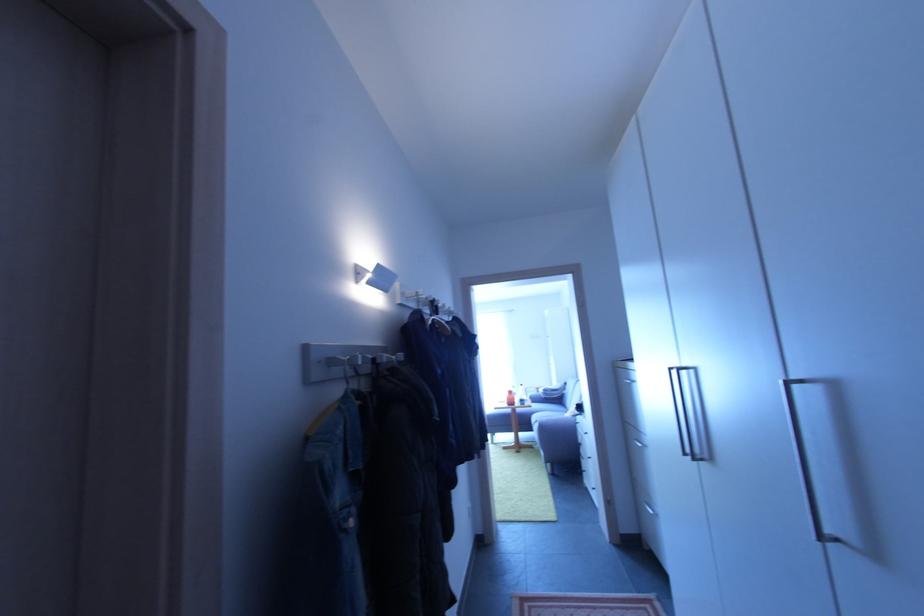
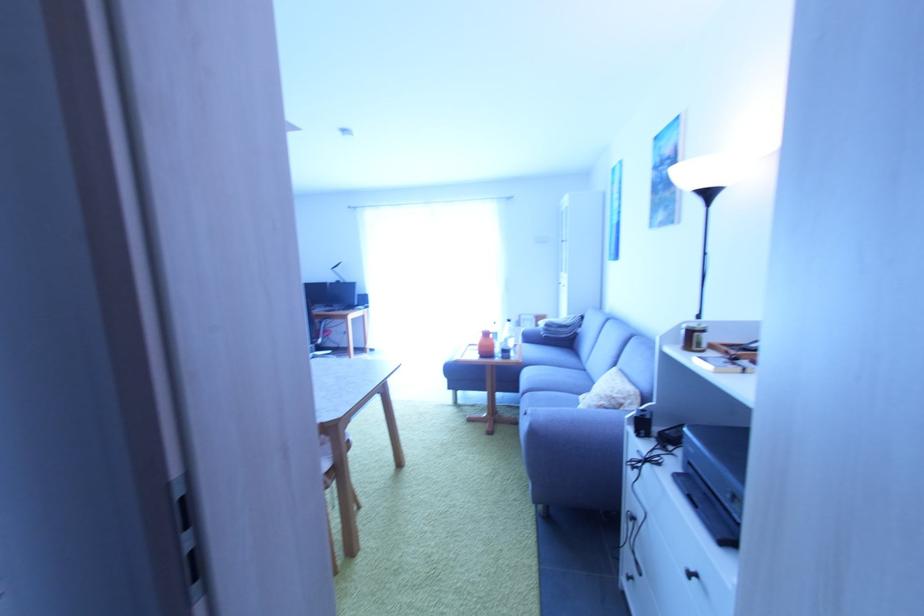
Question: In a continuous first-person perspective shot, in which direction is the camera moving?

Choices:
 (A) Left
 (B) Right
 (C) Forward
 (D) Backward

Answer: (C)